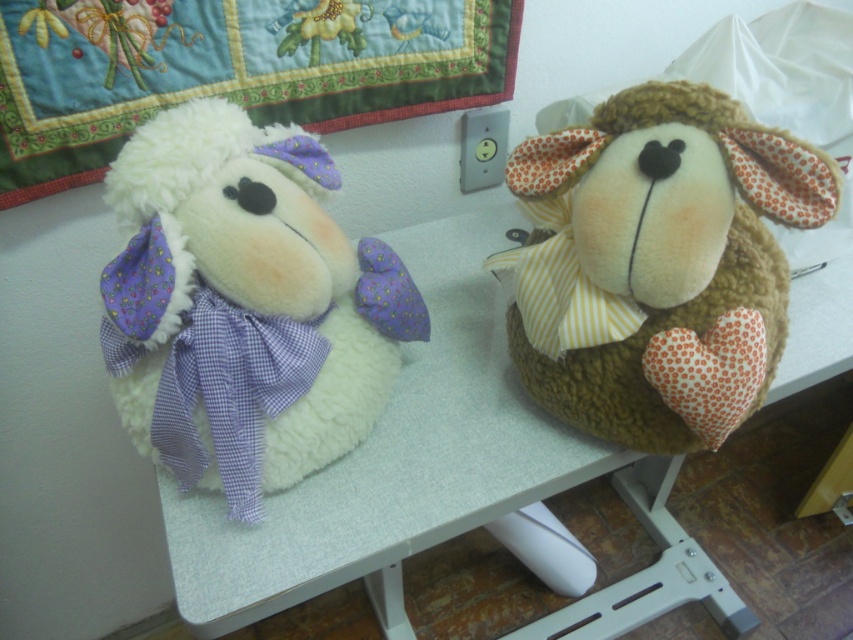
You are standing in front of a table with two sheep. The coordinates of the brown fuzzy stuffed animal at right are given as point (672, 260). If you want to place a new toy exactly halfway between the two sheep, what coordinates should you use?

To place the new toy halfway between the two sheep, calculate the midpoint between their coordinates. Since the brown fuzzy stuffed animal at right is at point (672, 260), and the other sheep is on the left, its coordinates would be assumed to be at point 0.592, 0.211. The midpoint would then be at coordinates 0.5, 0.5.

You are a toy organizer who needs to place a new toy between the white fluffy sheep at left and the embroidered cotton quilt at upper left. The toy is 12 inches long. Will there be enough space between them to fit the toy without overlapping?

The distance between the white fluffy sheep at left and the embroidered cotton quilt at upper left is 12.47 inches. Since the toy is 12 inches long, there is enough space to fit it between them without overlapping.

You are trying to decide which item to move first. Since the white fluffy sheep at left is smaller than the embroidered cotton quilt at upper left, which one would be easier to move?

The white fluffy sheep at left is smaller than the embroidered cotton quilt at upper left, so it would be easier to move.